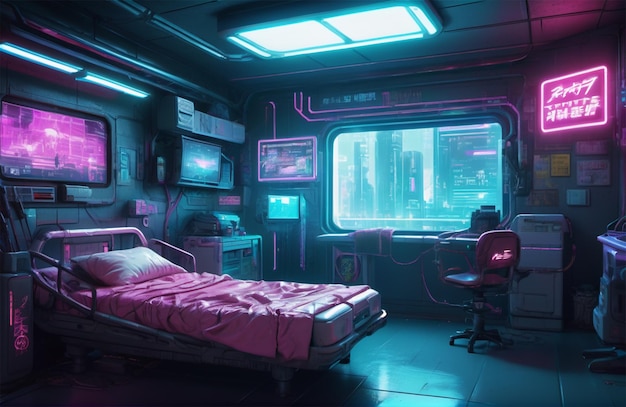
This screenshot has height=407, width=626. In order to click on window on ceiling in this screenshot , I will do `click(381, 26)`.